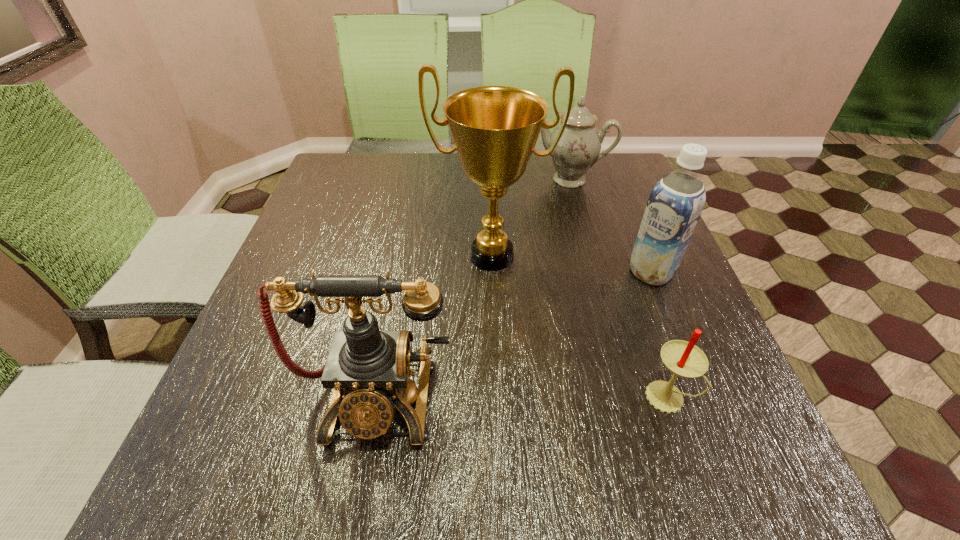
At what (x,y) coordinates should I click in order to perform the action: click on vacant space on the desktop that is between the telephone and the candle and is positioned on the spout of the fourth tallest object. Please return your answer as a coordinate pair (x, y). Looking at the image, I should click on (528, 397).

Locate an element on the screen. free space on the desktop that is between the telephone and the candle and is positioned on the front view with handles of the tallest object is located at coordinates (483, 397).

You are a GUI agent. You are given a task and a screenshot of the screen. Output one action in this format:
    pyautogui.click(x=<x>, y=<y>)
    Task: Click on the vacant space on the desktop that is between the telephone and the shortest object and is positioned on the label of the soya milk
    Image resolution: width=960 pixels, height=540 pixels.
    Given the screenshot: What is the action you would take?
    pyautogui.click(x=500, y=397)